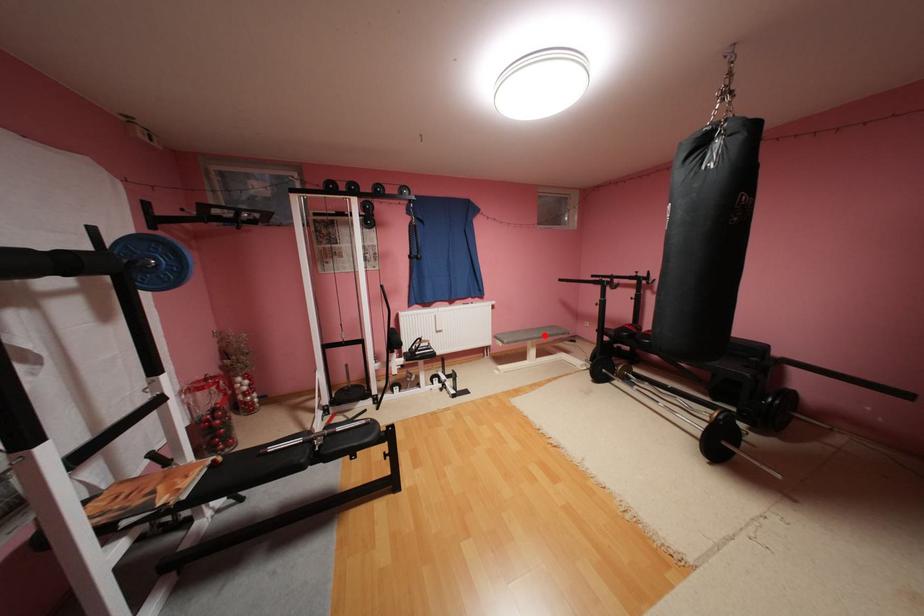
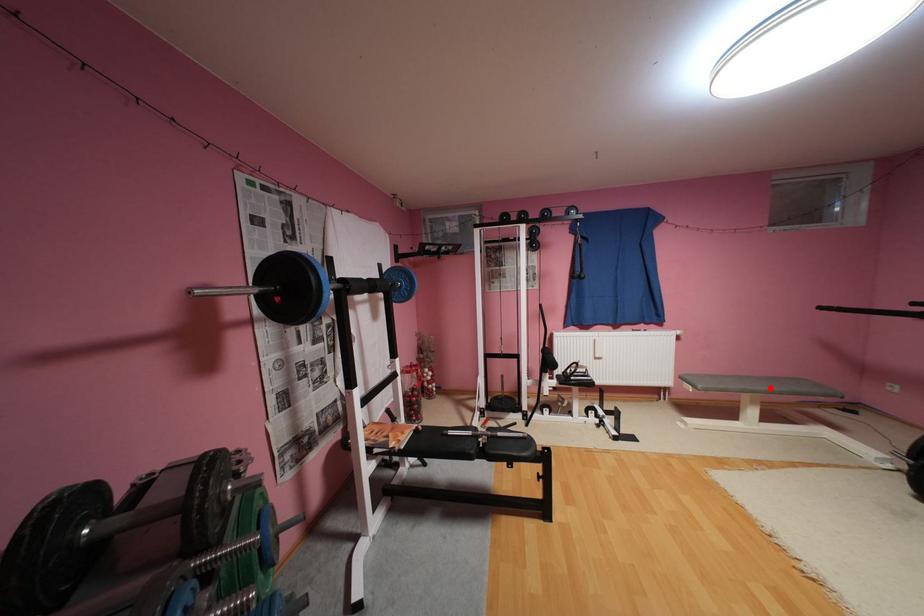
I am providing you with two images of the same scene from different viewpoints. A red point is marked on the first image and another point is marked on the second image. Is the red point in image1 aligned with the point shown in image2?

Yes